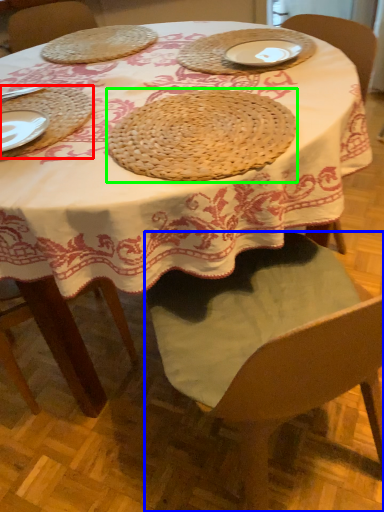
Question: Which object is the closest to the tray (highlighted by a red box)? Choose among these: chair (highlighted by a blue box) or pie (highlighted by a green box).

Choices:
 (A) chair
 (B) pie

Answer: (B)